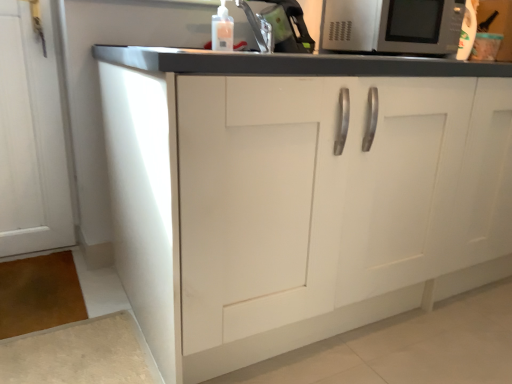
Question: Is white matte cabinet at center further to the viewer compared to satin silver microwave at upper right?

Choices:
 (A) yes
 (B) no

Answer: (B)

Question: From the image's perspective, is white matte cabinet at center located beneath satin silver microwave at upper right?

Choices:
 (A) no
 (B) yes

Answer: (B)

Question: Would you say white matte cabinet at center is a long distance from satin silver microwave at upper right?

Choices:
 (A) yes
 (B) no

Answer: (B)

Question: Is white matte cabinet at center thinner than satin silver microwave at upper right?

Choices:
 (A) no
 (B) yes

Answer: (A)

Question: Is white matte cabinet at center turned away from satin silver microwave at upper right?

Choices:
 (A) no
 (B) yes

Answer: (A)

Question: Can you confirm if white matte cabinet at center is bigger than satin silver microwave at upper right?

Choices:
 (A) yes
 (B) no

Answer: (A)

Question: From the image's perspective, does satin silver microwave at upper right appear lower than translucent plastic bottle at upper center?

Choices:
 (A) yes
 (B) no

Answer: (B)

Question: From the image's perspective, is satin silver microwave at upper right on translucent plastic bottle at upper center?

Choices:
 (A) no
 (B) yes

Answer: (B)

Question: Can you confirm if satin silver microwave at upper right is smaller than translucent plastic bottle at upper center?

Choices:
 (A) yes
 (B) no

Answer: (B)

Question: Is satin silver microwave at upper right directly adjacent to translucent plastic bottle at upper center?

Choices:
 (A) no
 (B) yes

Answer: (A)

Question: Is satin silver microwave at upper right bigger than translucent plastic bottle at upper center?

Choices:
 (A) no
 (B) yes

Answer: (B)

Question: Would you consider satin silver microwave at upper right to be distant from translucent plastic bottle at upper center?

Choices:
 (A) no
 (B) yes

Answer: (A)

Question: Is white matte cabinet at center next to translucent plastic bottle at upper center and touching it?

Choices:
 (A) yes
 (B) no

Answer: (B)